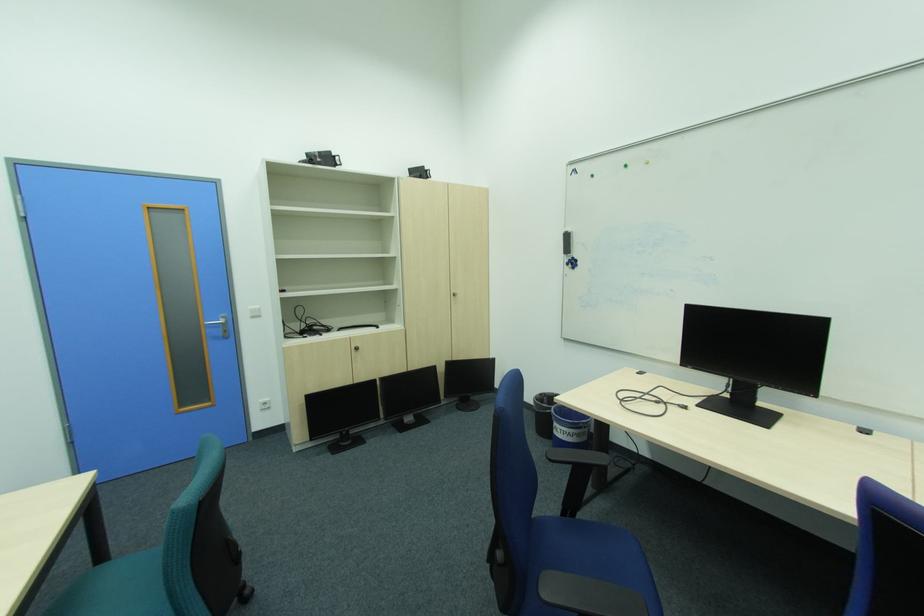
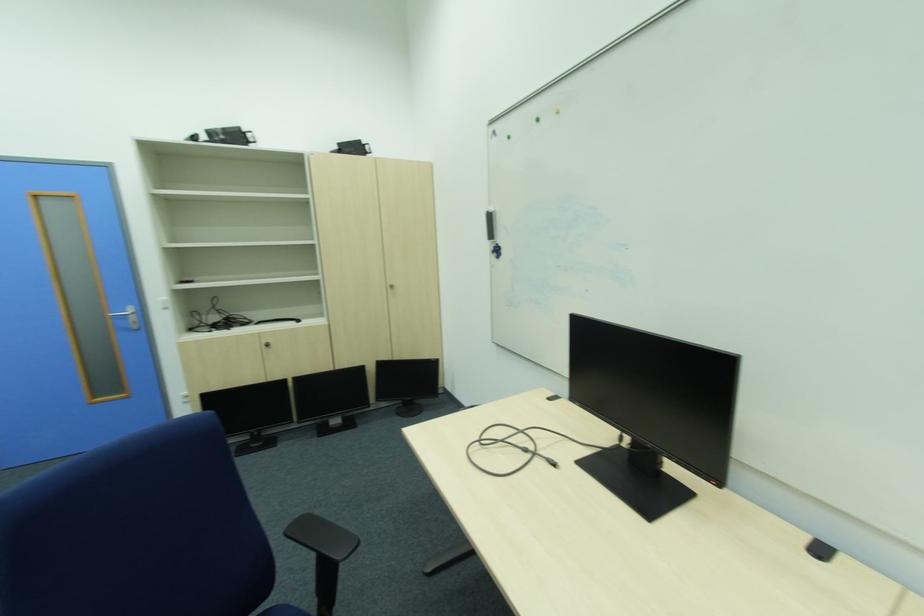
In a continuous first-person perspective shot, in which direction is the camera moving?

The cameraman walked toward right, forward.